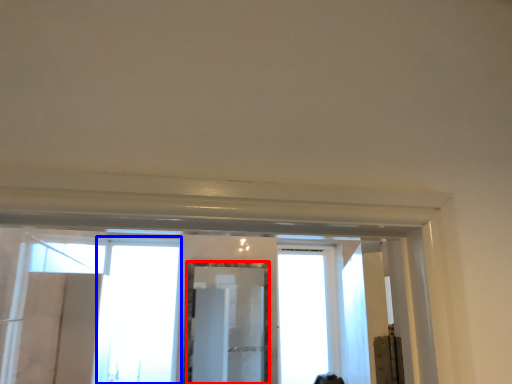
Question: Which point is closer to the camera, mirror (highlighted by a red box) or window (highlighted by a blue box)?

Choices:
 (A) mirror
 (B) window

Answer: (A)